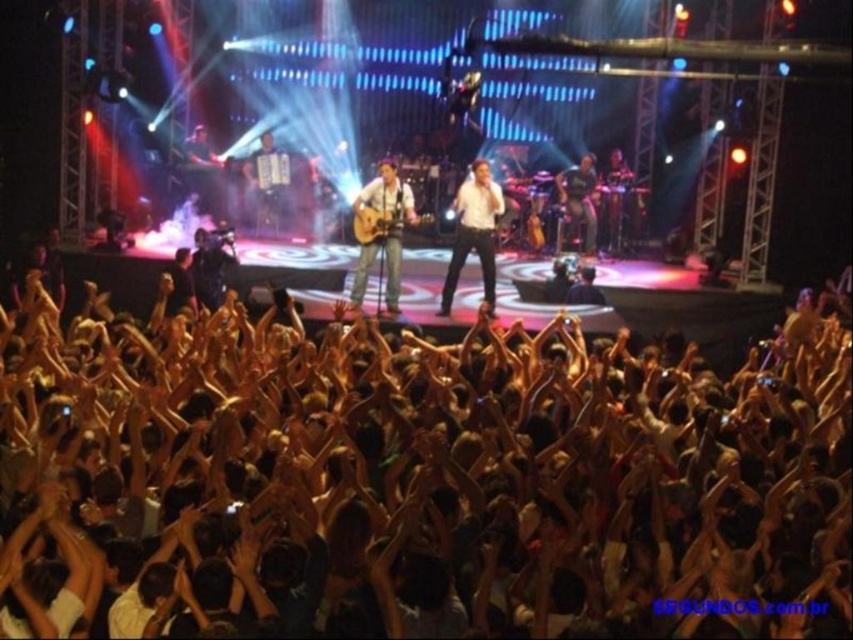
Does point (386, 259) come behind point (393, 214)?

Yes, it is behind point (393, 214).

Consider the image. Which is more to the right, matte brown acoustic guitar at center or acoustic wood guitar at center?

matte brown acoustic guitar at center

Between point (379, 204) and point (395, 212), which one is positioned behind?

The point (379, 204) is behind.

This screenshot has height=640, width=853. Find the location of `matte brown acoustic guitar at center`. matte brown acoustic guitar at center is located at coordinates (383, 230).

Between point (245, 422) and point (502, 202), which one is positioned in front?

Point (245, 422)

Can you confirm if brown skin tone crowd at center is bigger than white smooth shirt at center?

Yes.

Is point (337, 586) closer to camera compared to point (473, 198)?

Yes, it is.

I want to click on brown skin tone crowd at center, so click(x=418, y=481).

Does brown skin tone crowd at center have a lesser width compared to acoustic wood guitar at center?

No, brown skin tone crowd at center is not thinner than acoustic wood guitar at center.

Between point (543, 429) and point (355, 208), which one is positioned in front?

Point (543, 429) is more forward.

Does point (442, 611) lie in front of point (397, 211)?

That is True.

This screenshot has height=640, width=853. What are the coordinates of `brown skin tone crowd at center` in the screenshot? It's located at (418, 481).